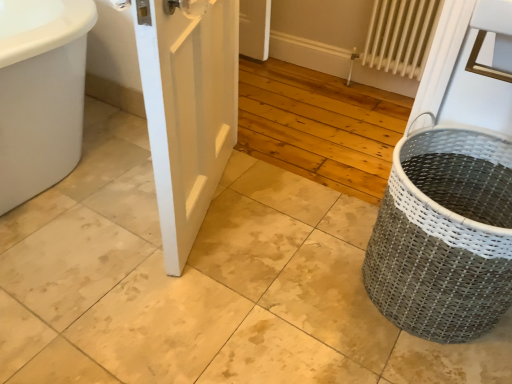
Question: Does white metal radiator at upper right have a lesser width compared to white matte door at center?

Choices:
 (A) no
 (B) yes

Answer: (B)

Question: Can you confirm if white metal radiator at upper right is shorter than white matte door at center?

Choices:
 (A) yes
 (B) no

Answer: (A)

Question: Is white metal radiator at upper right smaller than white matte door at center?

Choices:
 (A) no
 (B) yes

Answer: (B)

Question: Is white metal radiator at upper right turned away from white matte door at center?

Choices:
 (A) yes
 (B) no

Answer: (B)

Question: From the image's perspective, is white metal radiator at upper right below white matte door at center?

Choices:
 (A) yes
 (B) no

Answer: (B)

Question: Relative to white metal radiator at upper right, is gray woven basket at right in front or behind?

Choices:
 (A) behind
 (B) front

Answer: (B)

Question: Based on their sizes in the image, would you say gray woven basket at right is bigger or smaller than white metal radiator at upper right?

Choices:
 (A) small
 (B) big

Answer: (B)

Question: Is gray woven basket at right taller or shorter than white metal radiator at upper right?

Choices:
 (A) short
 (B) tall

Answer: (A)

Question: In terms of width, does gray woven basket at right look wider or thinner when compared to white metal radiator at upper right?

Choices:
 (A) wide
 (B) thin

Answer: (A)

Question: Is white metal radiator at upper right wider or thinner than gray woven basket at right?

Choices:
 (A) thin
 (B) wide

Answer: (A)

Question: Is white metal radiator at upper right bigger or smaller than gray woven basket at right?

Choices:
 (A) small
 (B) big

Answer: (A)

Question: From a real-world perspective, relative to gray woven basket at right, is white metal radiator at upper right vertically above or below?

Choices:
 (A) above
 (B) below

Answer: (A)

Question: From the image's perspective, relative to gray woven basket at right, is white metal radiator at upper right above or below?

Choices:
 (A) below
 (B) above

Answer: (B)

Question: Is white matte door at center in front of or behind white metal radiator at upper right in the image?

Choices:
 (A) behind
 (B) front

Answer: (B)

Question: Choose the correct answer: Is white matte door at center inside white metal radiator at upper right or outside it?

Choices:
 (A) inside
 (B) outside

Answer: (B)